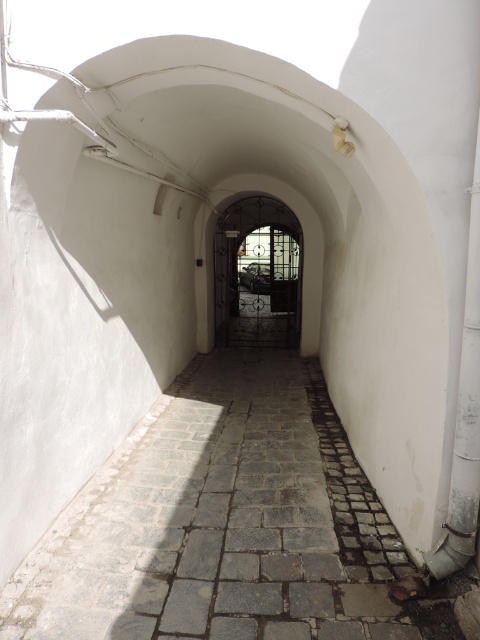
Question: Does gray stone path at center lie behind dark wrought iron gate at center?

Choices:
 (A) no
 (B) yes

Answer: (A)

Question: Is gray stone path at center to the right of dark wrought iron gate at center from the viewer's perspective?

Choices:
 (A) no
 (B) yes

Answer: (A)

Question: Can you confirm if gray stone path at center is positioned to the right of dark wrought iron gate at center?

Choices:
 (A) yes
 (B) no

Answer: (B)